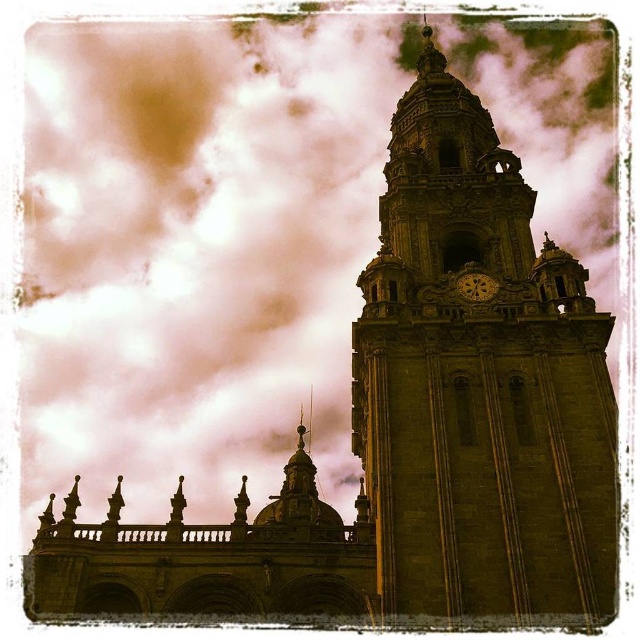
You are an architect evaluating the cathedral design. You notice the green stone clock tower at upper right and the gold textured clock at upper center. Which of these two objects is bigger in size?

The green stone clock tower at upper right is larger in size compared to the gold textured clock at upper center.